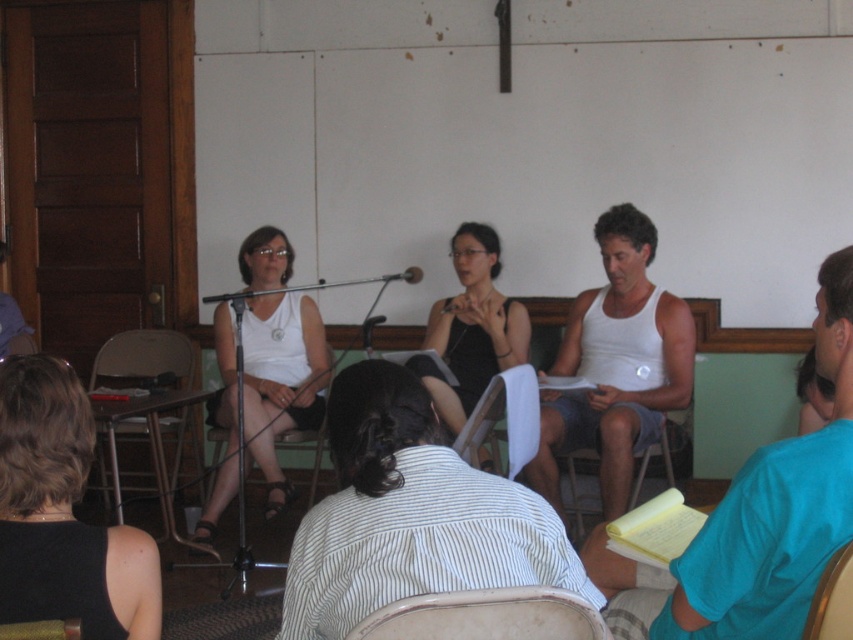
Question: Does wooden chair at lower center come in front of wooden chair at center?

Choices:
 (A) yes
 (B) no

Answer: (A)

Question: Which object is farther from the camera taking this photo?

Choices:
 (A) white matte tank top at center
 (B) metallic silver chair at center
 (C) wooden chair at lower center
 (D) wooden chair at lower left

Answer: (B)

Question: Which object is positioned closest to the wooden chair at lower left?

Choices:
 (A) wooden chair at center
 (B) metallic silver microphone at center

Answer: (A)

Question: Is metallic silver chair at lower left bigger than metallic gold chair at lower right?

Choices:
 (A) no
 (B) yes

Answer: (B)

Question: Which point appears closest to the camera in this image?

Choices:
 (A) (399, 276)
 (B) (1, 634)

Answer: (B)

Question: Does wooden chair at lower right have a lesser width compared to wooden chair at lower left?

Choices:
 (A) yes
 (B) no

Answer: (B)